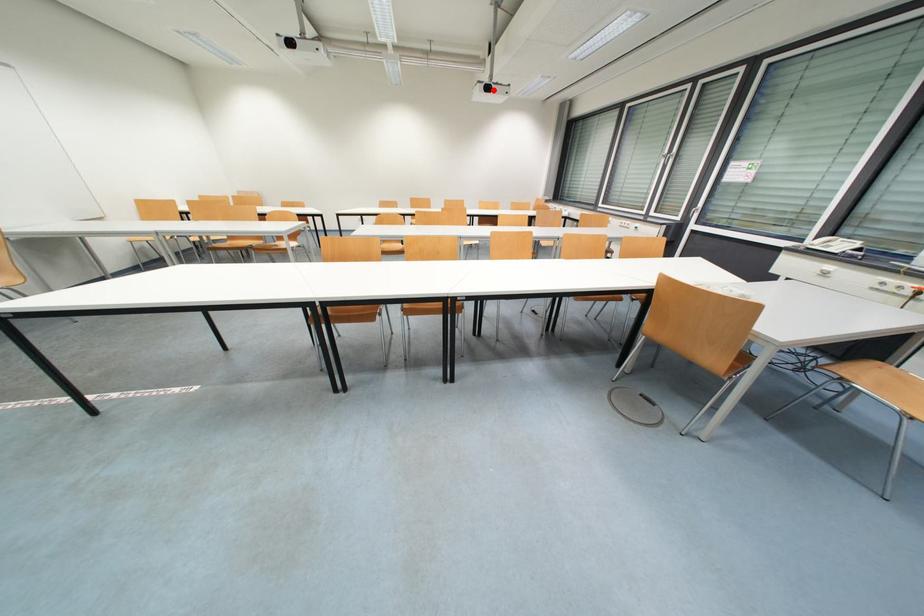
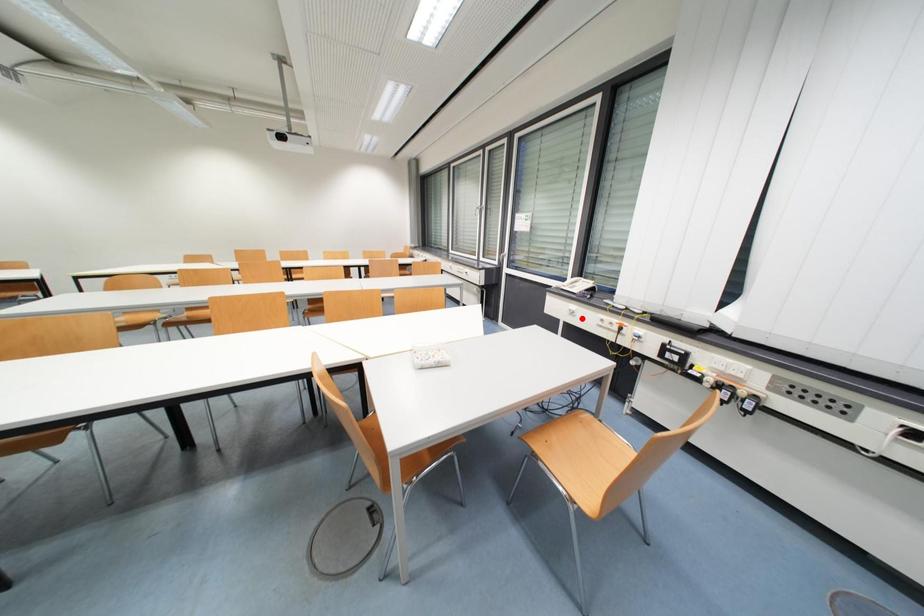
I am providing you with two images of the same scene from different viewpoints. A red point is marked on the first image and another point is marked on the second image. Are the points marked in image1 and image2 representing the same 3D position?

No